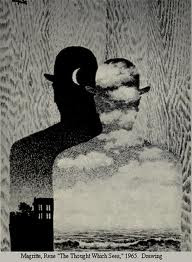
Where is `windows`? This screenshot has height=262, width=192. windows is located at coordinates point(40,207), point(49,207), point(50,218), point(40,214).